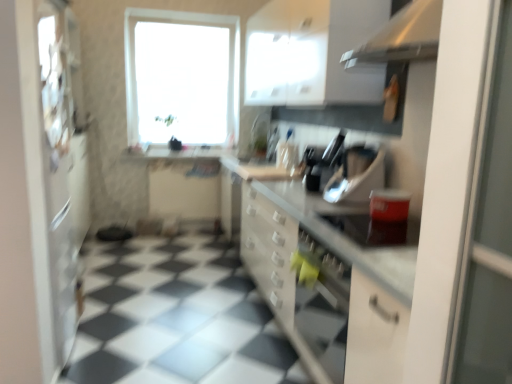
Question: Does metallic silver toaster at center, which is counted as the second appliance, starting from the back, have a lesser height compared to white glossy cabinet at upper center?

Choices:
 (A) yes
 (B) no

Answer: (A)

Question: Are metallic silver toaster at center, placed as the 2th appliance when sorted from front to back, and white glossy cabinet at upper center far apart?

Choices:
 (A) no
 (B) yes

Answer: (A)

Question: Considering the relative sizes of metallic silver toaster at center, placed as the 2th appliance when sorted from front to back, and white glossy cabinet at upper center in the image provided, is metallic silver toaster at center, placed as the 2th appliance when sorted from front to back, bigger than white glossy cabinet at upper center?

Choices:
 (A) no
 (B) yes

Answer: (A)

Question: Is metallic silver toaster at center, placed as the 2th appliance when sorted from front to back, touching white glossy cabinet at upper center?

Choices:
 (A) no
 (B) yes

Answer: (A)

Question: From a real-world perspective, is metallic silver toaster at center, which is counted as the second appliance, starting from the back, physically below white glossy cabinet at upper center?

Choices:
 (A) no
 (B) yes

Answer: (B)

Question: Does metallic silver toaster at center, which is counted as the second appliance, starting from the back, contain white glossy cabinet at upper center?

Choices:
 (A) yes
 (B) no

Answer: (B)

Question: Is white glossy cabinet at upper center shorter than black glossy tile at center?

Choices:
 (A) no
 (B) yes

Answer: (A)

Question: Is white glossy cabinet at upper center aimed at black glossy tile at center?

Choices:
 (A) no
 (B) yes

Answer: (A)

Question: Is white glossy cabinet at upper center bigger than black glossy tile at center?

Choices:
 (A) yes
 (B) no

Answer: (A)

Question: Does white glossy cabinet at upper center have a lesser width compared to black glossy tile at center?

Choices:
 (A) yes
 (B) no

Answer: (A)

Question: From the image's perspective, would you say white glossy cabinet at upper center is positioned over black glossy tile at center?

Choices:
 (A) yes
 (B) no

Answer: (A)

Question: Is white glossy cabinet at upper center not close to black glossy tile at center?

Choices:
 (A) no
 (B) yes

Answer: (B)

Question: Can you confirm if metallic silver toaster at center, which is counted as the second appliance, starting from the back, is smaller than white glossy countertop at center?

Choices:
 (A) yes
 (B) no

Answer: (A)